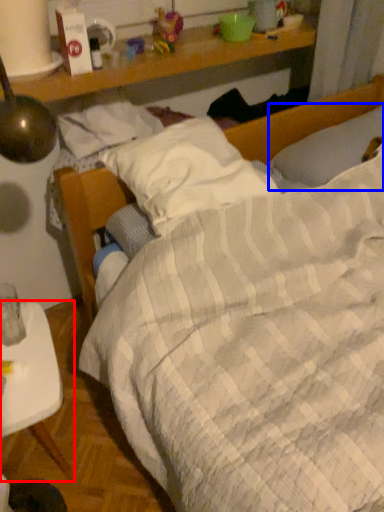
Question: Which point is further to the camera, desk (highlighted by a red box) or pillow (highlighted by a blue box)?

Choices:
 (A) desk
 (B) pillow

Answer: (B)